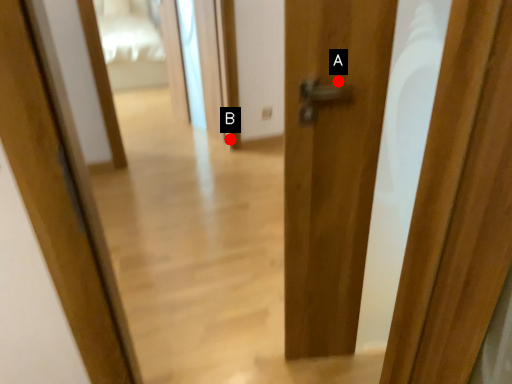
Question: Two points are circled on the image, labeled by A and B beside each circle. Which point is closer to the camera taking this photo?

Choices:
 (A) A is closer
 (B) B is closer

Answer: (A)